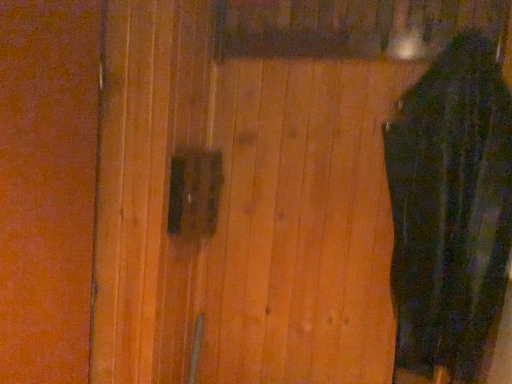
Measure the distance between point (475, 107) and camera.

They are 34.61 inches apart.

What do you see at coordinates (450, 212) in the screenshot?
I see `dark blue textured jacket at right` at bounding box center [450, 212].

At what (x,y) coordinates should I click in order to perform the action: click on dark blue textured jacket at right. Please return your answer as a coordinate pair (x, y). The image size is (512, 384). Looking at the image, I should click on (450, 212).

Image resolution: width=512 pixels, height=384 pixels. Find the location of `dark blue textured jacket at right`. dark blue textured jacket at right is located at coordinates point(450,212).